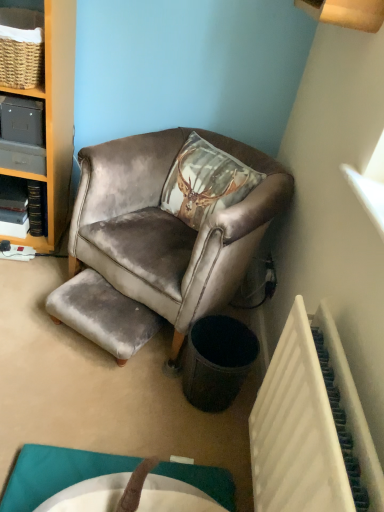
You are a GUI agent. You are given a task and a screenshot of the screen. Output one action in this format:
    pyautogui.click(x=<x>, y=<y>)
    Task: Click on the vacant area that is in front of velvet grey stool at lower left
    The width and height of the screenshot is (384, 512).
    Given the screenshot: What is the action you would take?
    pyautogui.click(x=84, y=392)